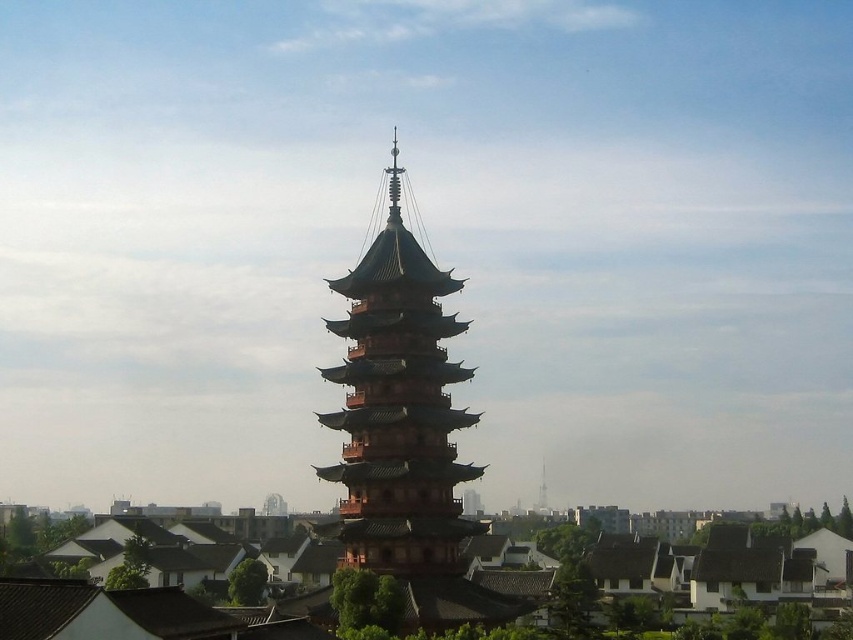
Based on the photo, can you confirm if brown wooden pagoda at center is smaller than smooth white spire at center?

No.

Who is more distant from viewer, (418,294) or (544,481)?

Point (544,481)

Where is `brown wooden pagoda at center`? Image resolution: width=853 pixels, height=640 pixels. brown wooden pagoda at center is located at coordinates (398, 410).